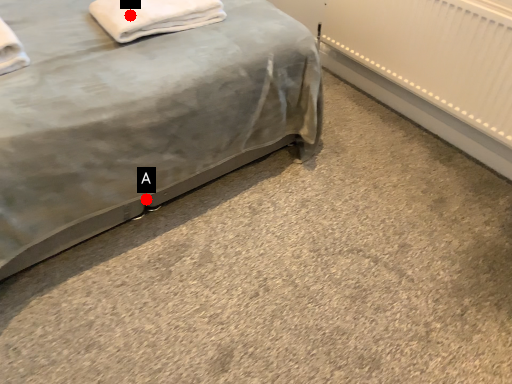
Question: Two points are circled on the image, labeled by A and B beside each circle. Among these points, which one is farthest from the camera?

Choices:
 (A) A is further
 (B) B is further

Answer: (A)